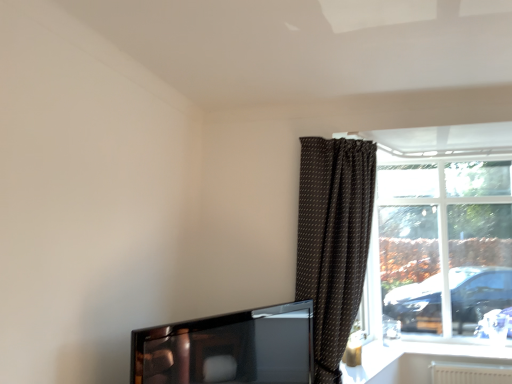
Question: Is brown dotted fabric curtain at right positioned with its back to transparent glass window at right?

Choices:
 (A) no
 (B) yes

Answer: (A)

Question: From the image's perspective, is brown dotted fabric curtain at right located above transparent glass window at right?

Choices:
 (A) yes
 (B) no

Answer: (A)

Question: Is brown dotted fabric curtain at right facing towards transparent glass window at right?

Choices:
 (A) yes
 (B) no

Answer: (B)

Question: Can you confirm if brown dotted fabric curtain at right is positioned to the left of transparent glass window at right?

Choices:
 (A) no
 (B) yes

Answer: (B)

Question: Does brown dotted fabric curtain at right lie in front of transparent glass window at right?

Choices:
 (A) yes
 (B) no

Answer: (A)

Question: Visually, is white glossy window sill at lower right positioned to the left or to the right of transparent glass window at right?

Choices:
 (A) right
 (B) left

Answer: (B)

Question: From their relative heights in the image, would you say white glossy window sill at lower right is taller or shorter than transparent glass window at right?

Choices:
 (A) tall
 (B) short

Answer: (B)

Question: From a real-world perspective, relative to transparent glass window at right, is white glossy window sill at lower right vertically above or below?

Choices:
 (A) below
 (B) above

Answer: (A)

Question: Is white glossy window sill at lower right situated inside transparent glass window at right or outside?

Choices:
 (A) outside
 (B) inside

Answer: (A)

Question: In terms of height, does shiny black tv at lower left look taller or shorter compared to white glossy window sill at lower right?

Choices:
 (A) short
 (B) tall

Answer: (B)

Question: From the image's perspective, is shiny black tv at lower left above or below white glossy window sill at lower right?

Choices:
 (A) below
 (B) above

Answer: (B)

Question: Considering their positions, is shiny black tv at lower left located in front of or behind white glossy window sill at lower right?

Choices:
 (A) behind
 (B) front

Answer: (B)

Question: Based on their positions, is shiny black tv at lower left located to the left or right of white glossy window sill at lower right?

Choices:
 (A) left
 (B) right

Answer: (A)

Question: Looking at the image, does brown dotted fabric curtain at right seem bigger or smaller compared to white glossy window sill at lower right?

Choices:
 (A) small
 (B) big

Answer: (B)

Question: Visually, is brown dotted fabric curtain at right positioned to the left or to the right of white glossy window sill at lower right?

Choices:
 (A) right
 (B) left

Answer: (B)